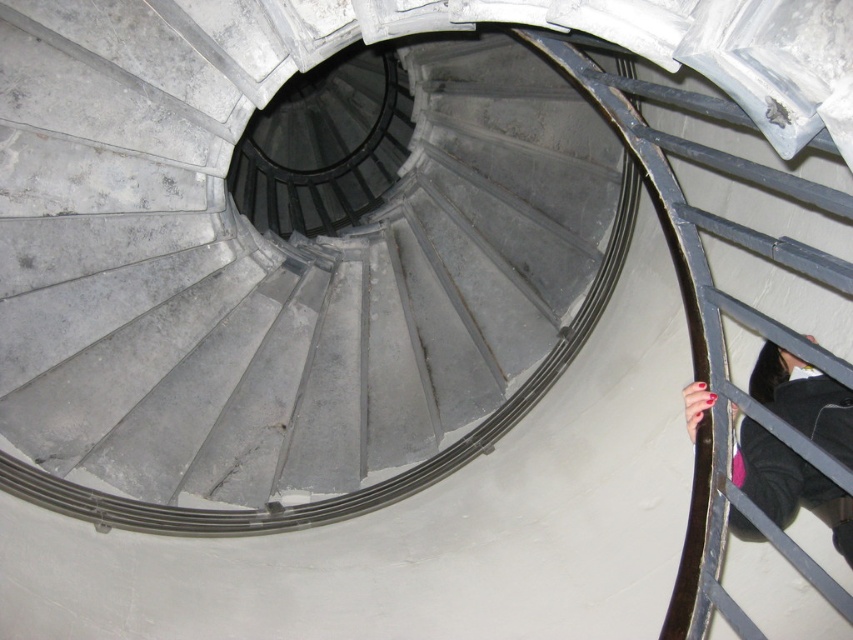
Question: Which point is closer to the camera?

Choices:
 (A) dark gray fabric hand at lower right
 (B) gray concrete spiral staircase at center

Answer: (A)

Question: Can you confirm if gray concrete spiral staircase at center is smaller than dark gray fabric hand at lower right?

Choices:
 (A) no
 (B) yes

Answer: (A)

Question: Can you confirm if gray concrete spiral staircase at center is positioned to the left of dark gray fabric hand at lower right?

Choices:
 (A) no
 (B) yes

Answer: (B)

Question: Which point is closer to the camera taking this photo?

Choices:
 (A) (764, 500)
 (B) (376, 348)

Answer: (A)

Question: Is gray concrete spiral staircase at center thinner than dark gray fabric hand at lower right?

Choices:
 (A) yes
 (B) no

Answer: (B)